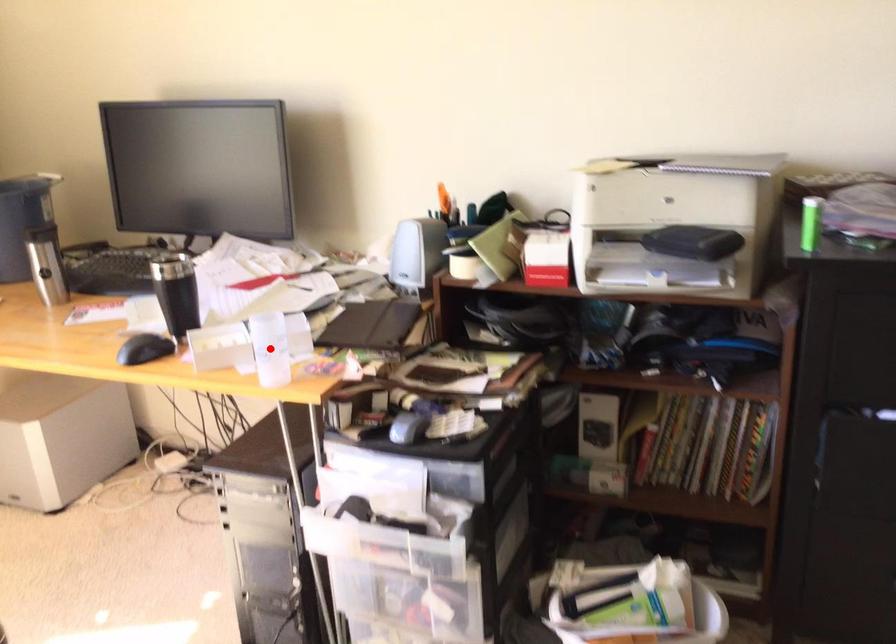
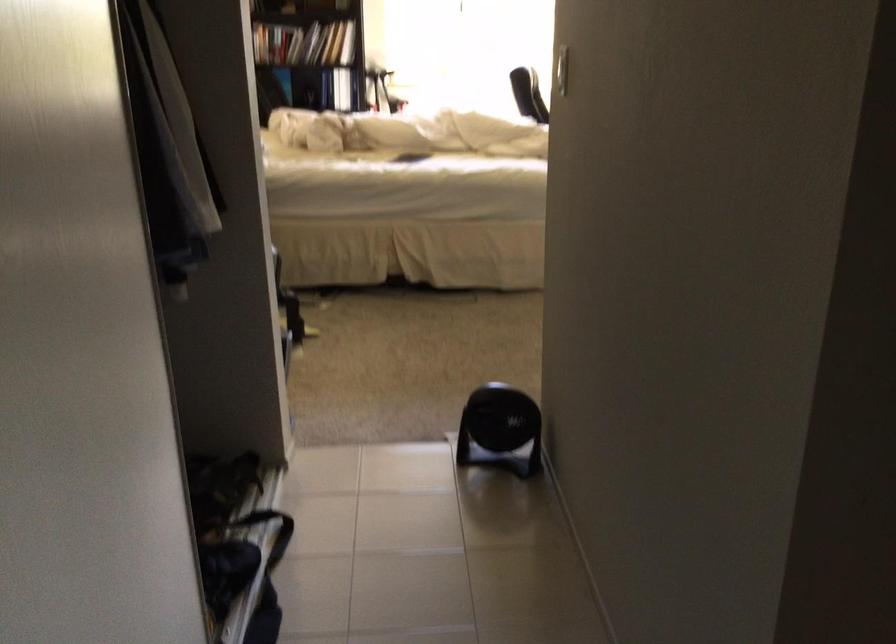
Question: I am providing you with two images of the same scene from different viewpoints. A red point is marked on the first image. Can you still see the location of the red point in image 2?

Choices:
 (A) Yes
 (B) No

Answer: (B)